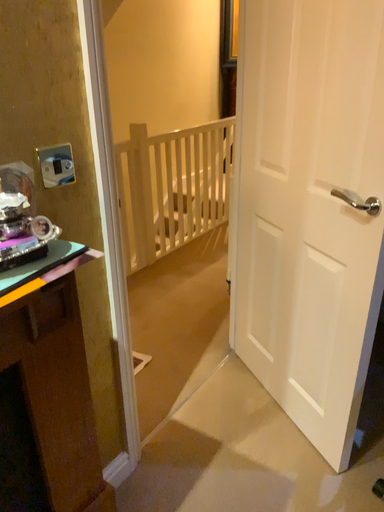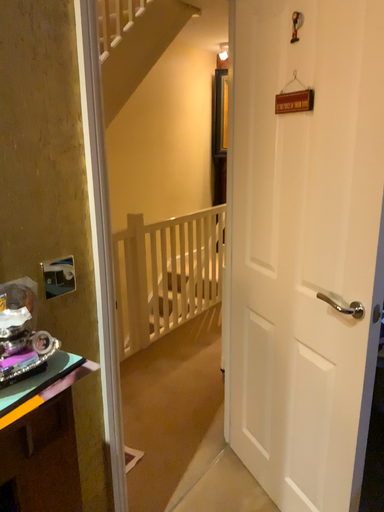
Question: Which way did the camera rotate in the video?

Choices:
 (A) rotated downward
 (B) rotated upward

Answer: (B)